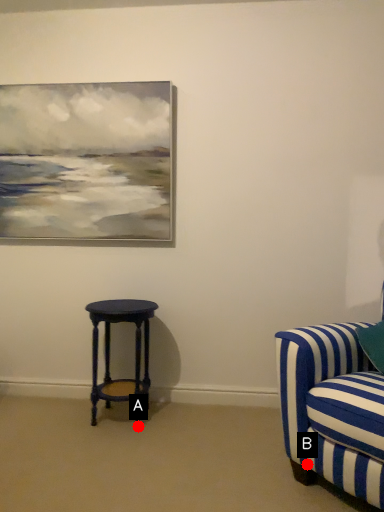
Question: Two points are circled on the image, labeled by A and B beside each circle. Which point is closer to the camera?

Choices:
 (A) A is closer
 (B) B is closer

Answer: (B)